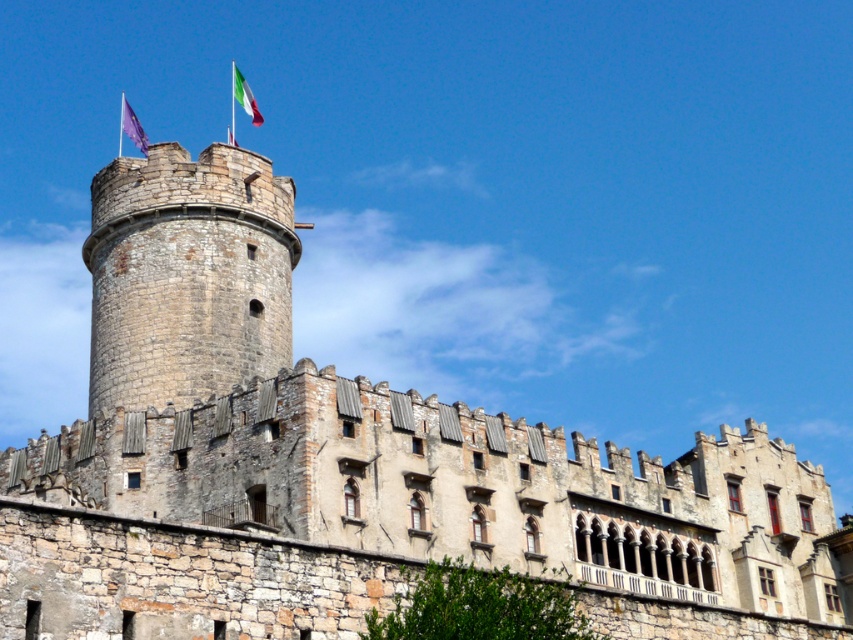
Does purple fabric flag at top have a greater width compared to green fabric flag at top center?

Indeed, purple fabric flag at top has a greater width compared to green fabric flag at top center.

Image resolution: width=853 pixels, height=640 pixels. What do you see at coordinates (131, 128) in the screenshot?
I see `purple fabric flag at top` at bounding box center [131, 128].

The image size is (853, 640). Find the location of `purple fabric flag at top`. purple fabric flag at top is located at coordinates click(131, 128).

Between point (265, 371) and point (119, 140), which one is positioned behind?

Positioned behind is point (119, 140).

Looking at this image, can you confirm if rustic stone tower at center is wider than purple fabric flag at top?

Correct, the width of rustic stone tower at center exceeds that of purple fabric flag at top.

The image size is (853, 640). Find the location of `rustic stone tower at center`. rustic stone tower at center is located at coordinates (187, 275).

You are a GUI agent. You are given a task and a screenshot of the screen. Output one action in this format:
    pyautogui.click(x=<x>, y=<y>)
    Task: Click on the rustic stone tower at center
    The image size is (853, 640).
    Given the screenshot: What is the action you would take?
    pyautogui.click(x=187, y=275)

Which of these two, rustic stone tower at center or green fabric flag at top center, stands taller?

green fabric flag at top center is taller.

Which is above, rustic stone tower at center or green fabric flag at top center?

green fabric flag at top center

Which is in front, point (187, 220) or point (245, 84)?

Point (187, 220)

Find the location of a particular element. rustic stone tower at center is located at coordinates (187, 275).